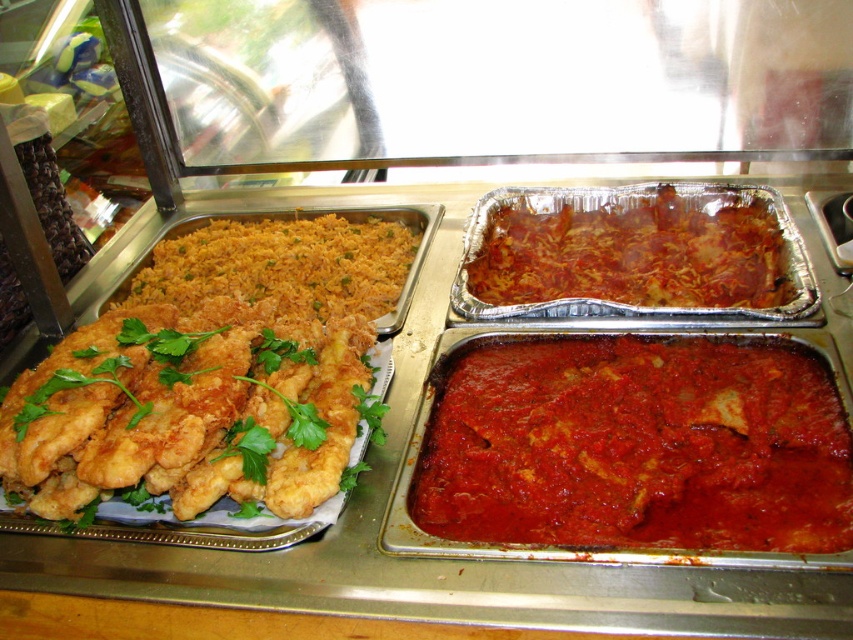
Question: Does golden fried chicken strips at left appear on the right side of red matte lasagna at center?

Choices:
 (A) yes
 (B) no

Answer: (B)

Question: Which point is farther to the camera?

Choices:
 (A) (509, 384)
 (B) (106, 465)

Answer: (A)

Question: Which point appears closest to the camera in this image?

Choices:
 (A) (544, 280)
 (B) (306, 252)
 (C) (521, 362)
 (D) (363, 371)

Answer: (D)

Question: Where is golden fried chicken strips at left located in relation to yellow rice at left in the image?

Choices:
 (A) above
 (B) below

Answer: (B)

Question: Can you confirm if red matte sauce at center is positioned to the left of red matte lasagna at center?

Choices:
 (A) yes
 (B) no

Answer: (A)

Question: Which of these objects is positioned farthest from the red matte lasagna at center?

Choices:
 (A) red matte sauce at center
 (B) golden fried chicken strips at left

Answer: (B)